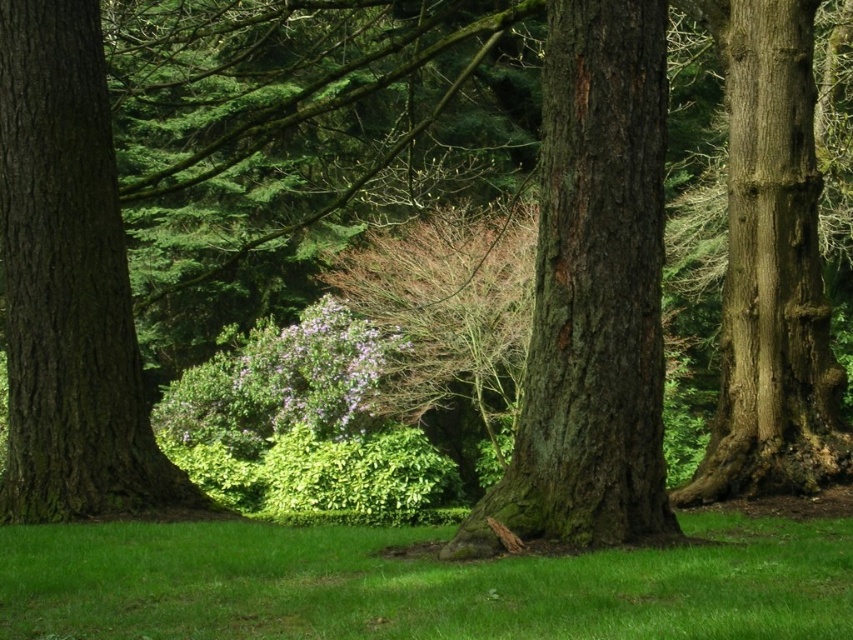
Question: Does green grassy at center appear over smooth brown tree trunk at center?

Choices:
 (A) no
 (B) yes

Answer: (A)

Question: Which of the following is the farthest from the observer?

Choices:
 (A) smooth brown bark at right
 (B) green rough bark tree trunk at center

Answer: (A)

Question: Which point is closer to the camera?

Choices:
 (A) (489, 524)
 (B) (306, 560)
 (C) (38, 305)
 (D) (807, 396)

Answer: (B)

Question: Can you confirm if smooth brown tree trunk at center is bigger than smooth brown bark at right?

Choices:
 (A) no
 (B) yes

Answer: (B)

Question: Which point is farther to the camera?

Choices:
 (A) green grassy at center
 (B) smooth brown tree trunk at center
 (C) green rough bark tree trunk at center

Answer: (B)

Question: Can you confirm if green rough bark tree trunk at center is wider than smooth brown bark at right?

Choices:
 (A) yes
 (B) no

Answer: (B)